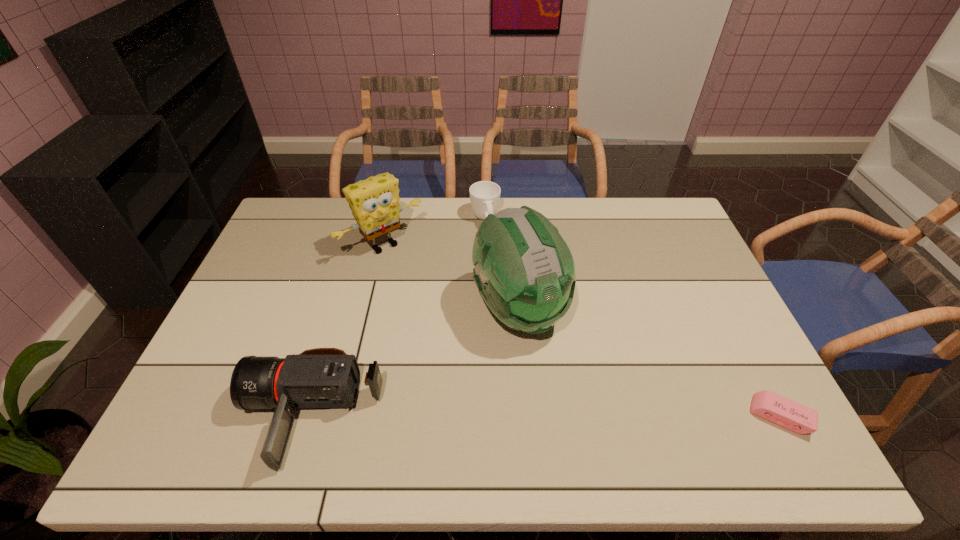
Identify the location of camcorder. (322, 377).

This screenshot has height=540, width=960. In order to click on the rightmost object in this screenshot , I will do `click(768, 405)`.

You are a GUI agent. You are given a task and a screenshot of the screen. Output one action in this format:
    pyautogui.click(x=<x>, y=<y>)
    Task: Click on the shortest object
    
    Given the screenshot: What is the action you would take?
    pyautogui.click(x=768, y=405)

The image size is (960, 540). I want to click on sponge, so click(x=374, y=202).

Find the location of a particular element. the tallest object is located at coordinates (524, 270).

Where is `football helmet`? The image size is (960, 540). football helmet is located at coordinates (524, 270).

This screenshot has height=540, width=960. I want to click on cup, so click(484, 195).

Find the location of a particular element. This screenshot has width=960, height=540. vacant space positioned 0.100m on the lens of the camcorder is located at coordinates (204, 415).

Image resolution: width=960 pixels, height=540 pixels. I want to click on free spot located on the left of the rightmost object, so click(709, 416).

Find the location of a particular element. The height and width of the screenshot is (540, 960). vacant region located 0.260m on the face of the second tallest object is located at coordinates (448, 310).